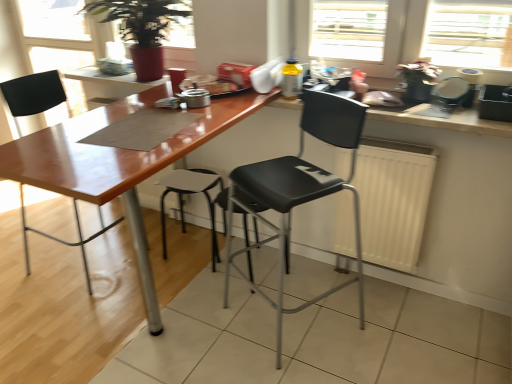
This screenshot has height=384, width=512. What are the coordinates of `free space above matte black stool at center (from a real-world perspective)` in the screenshot? It's located at (193, 178).